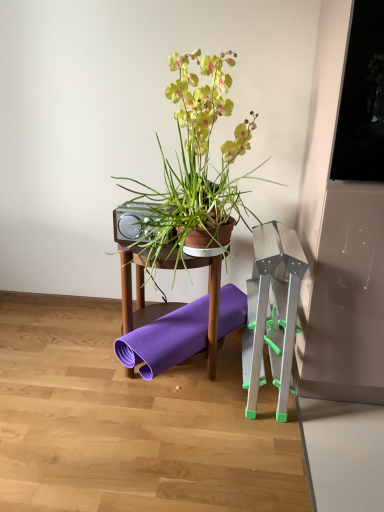
Where is `vacant area in front of wooden table at center`? The image size is (384, 512). vacant area in front of wooden table at center is located at coordinates (165, 426).